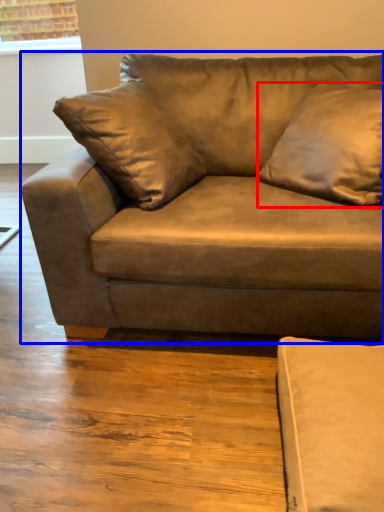
Question: Which object appears closest to the camera in this image, pillow (highlighted by a red box) or studio couch (highlighted by a blue box)?

Choices:
 (A) pillow
 (B) studio couch

Answer: (B)